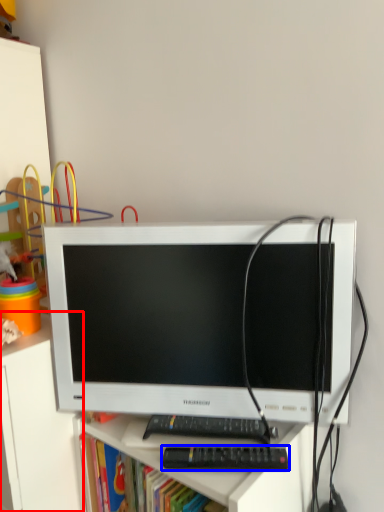
Question: Which of the following is the farthest to the observer, file cabinet (highlighted by a red box) or control (highlighted by a blue box)?

Choices:
 (A) file cabinet
 (B) control

Answer: (A)